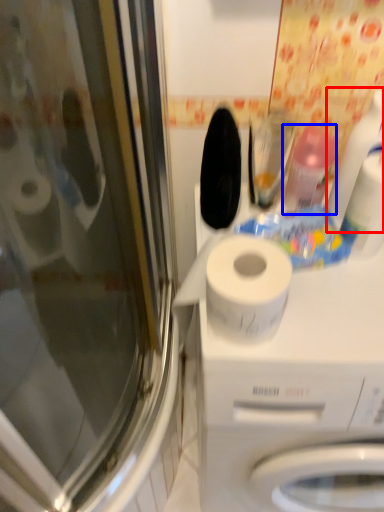
Question: Which object is closer to the camera taking this photo, cleaning product (highlighted by a red box) or cleaning product (highlighted by a blue box)?

Choices:
 (A) cleaning product
 (B) cleaning product

Answer: (A)